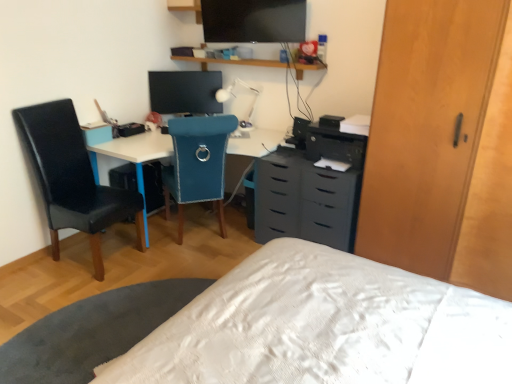
Question: Is light brown wood dresser at right spatially inside flat matte screen at upper center, or outside of it?

Choices:
 (A) outside
 (B) inside

Answer: (A)

Question: Considering the positions of light brown wood dresser at right and flat matte screen at upper center in the image, is light brown wood dresser at right bigger or smaller than flat matte screen at upper center?

Choices:
 (A) big
 (B) small

Answer: (A)

Question: Estimate the real-world distances between objects in this image. Which object is closer to the white plastic table lamp at center?

Choices:
 (A) black leather chair at left, placed as the second chair when sorted from right to left
 (B) wooden shelf at upper center
 (C) teal fabric chair at center, placed as the 1th chair when sorted from right to left
 (D) flat matte screen at upper center
 (E) white glossy table at lower left

Answer: (B)

Question: Which of these objects is positioned farthest from the white plastic table lamp at center?

Choices:
 (A) light brown wood dresser at right
 (B) white glossy table at lower left
 (C) black leather chair at left, placed as the second chair when sorted from right to left
 (D) white plastic desk at center
 (E) matte black monitor at center

Answer: (B)